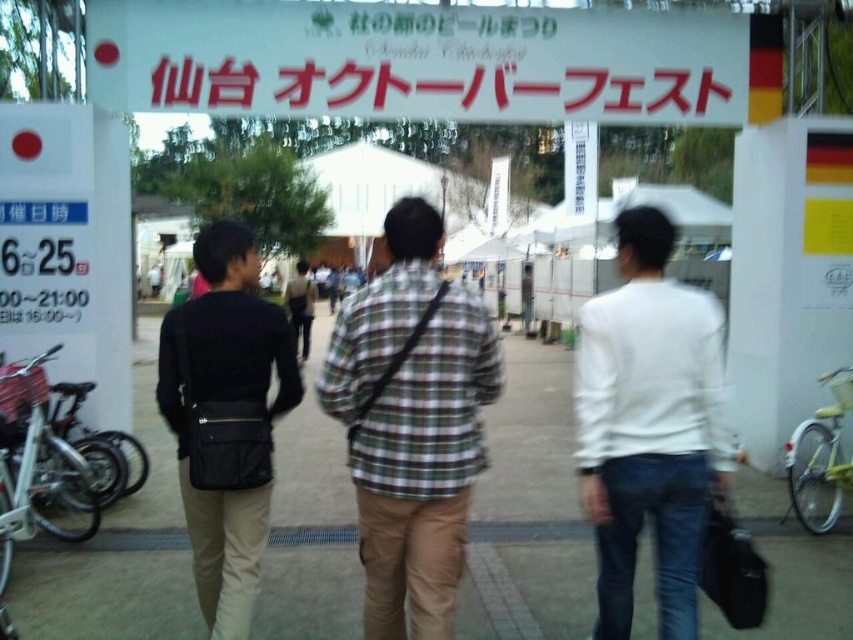
Question: Which point is closer to the camera?

Choices:
 (A) white paper sign at upper center
 (B) black leather bag at center
 (C) concrete pavement at center
 (D) green plaid shirt at center

Answer: (D)

Question: Estimate the real-world distances between objects in this image. Which object is closer to the black leather bag at center?

Choices:
 (A) green plaid shirt at center
 (B) white matte shirt at center
 (C) white paper sign at upper center

Answer: (A)

Question: Is concrete pavement at center bigger than black leather bag at center?

Choices:
 (A) yes
 (B) no

Answer: (B)

Question: Which of the following is the farthest from the observer?

Choices:
 (A) (431, 284)
 (B) (120, 19)

Answer: (B)

Question: Does concrete pavement at center appear on the right side of black leather bag at center?

Choices:
 (A) no
 (B) yes

Answer: (B)

Question: In this image, where is white matte shirt at center located relative to black leather bag at center?

Choices:
 (A) above
 (B) below

Answer: (B)